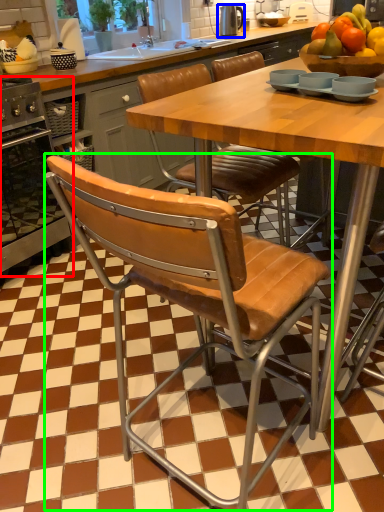
Question: Considering the real-world distances, which object is farthest from oven (highlighted by a red box)? appliance (highlighted by a blue box) or chair (highlighted by a green box)?

Choices:
 (A) appliance
 (B) chair

Answer: (A)